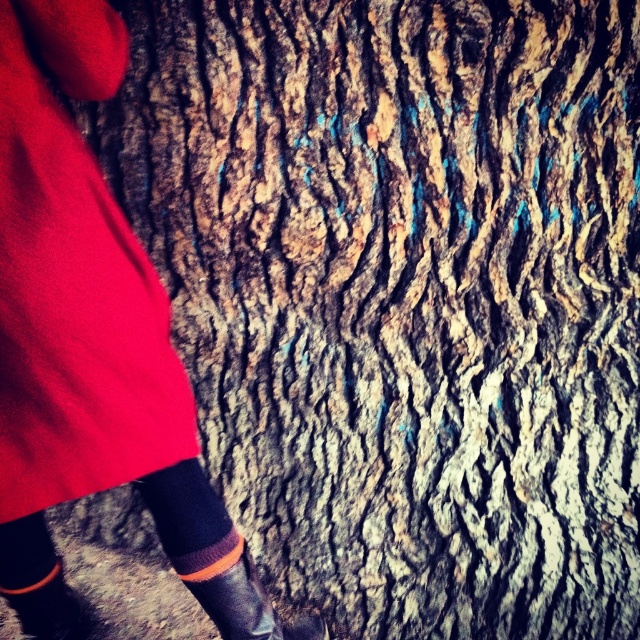
Question: Is matte red fabric at left smaller than rubber boot at lower left?

Choices:
 (A) yes
 (B) no

Answer: (B)

Question: Does matte red fabric at left appear on the right side of rubber boot at lower left?

Choices:
 (A) no
 (B) yes

Answer: (A)

Question: Which of the following is the farthest from the observer?

Choices:
 (A) (28, 422)
 (B) (234, 628)

Answer: (B)

Question: Can you confirm if matte red fabric at left is smaller than rubber boot at lower left?

Choices:
 (A) yes
 (B) no

Answer: (B)

Question: Which point is farther from the camera taking this photo?

Choices:
 (A) (273, 609)
 (B) (48, 154)

Answer: (A)